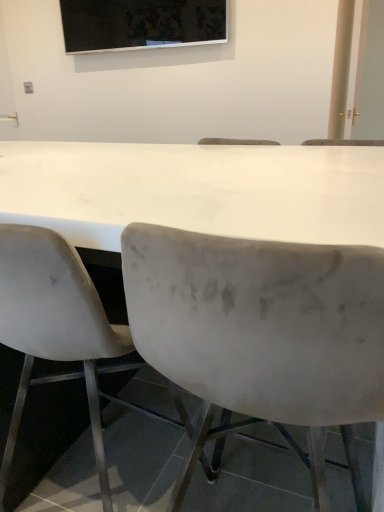
Question: From a real-world perspective, is white matte chair at left, positioned as the first chair in left-to-right order, beneath velvet gray chair at center, which is counted as the 1th chair, starting from the right?

Choices:
 (A) yes
 (B) no

Answer: (A)

Question: Could you tell me if white matte chair at left, positioned as the first chair in left-to-right order, is turned towards velvet gray chair at center, which is counted as the 1th chair, starting from the right?

Choices:
 (A) yes
 (B) no

Answer: (B)

Question: Is velvet gray chair at center, the second chair when ordered from left to right, located within white matte chair at left, positioned as the first chair in left-to-right order?

Choices:
 (A) no
 (B) yes

Answer: (A)

Question: Does white matte chair at left, positioned as the first chair in left-to-right order, come behind velvet gray chair at center, which is counted as the 1th chair, starting from the right?

Choices:
 (A) yes
 (B) no

Answer: (A)

Question: Is white matte chair at left, arranged as the 2th chair when viewed from the right, far from velvet gray chair at center, the second chair when ordered from left to right?

Choices:
 (A) yes
 (B) no

Answer: (B)

Question: Is white matte chair at left, positioned as the first chair in left-to-right order, not within velvet gray chair at center, which is counted as the 1th chair, starting from the right?

Choices:
 (A) yes
 (B) no

Answer: (A)

Question: Does velvet gray chair at center, the second chair when ordered from left to right, turn towards white glossy door at upper right?

Choices:
 (A) no
 (B) yes

Answer: (B)

Question: Does velvet gray chair at center, the second chair when ordered from left to right, come in front of white glossy door at upper right?

Choices:
 (A) yes
 (B) no

Answer: (A)

Question: Are velvet gray chair at center, which is counted as the 1th chair, starting from the right, and white glossy door at upper right located far from each other?

Choices:
 (A) no
 (B) yes

Answer: (B)

Question: Is velvet gray chair at center, the second chair when ordered from left to right, turned away from white glossy door at upper right?

Choices:
 (A) no
 (B) yes

Answer: (A)

Question: Considering the relative sizes of velvet gray chair at center, which is counted as the 1th chair, starting from the right, and white glossy door at upper right in the image provided, is velvet gray chair at center, which is counted as the 1th chair, starting from the right, shorter than white glossy door at upper right?

Choices:
 (A) no
 (B) yes

Answer: (B)

Question: Is velvet gray chair at center, which is counted as the 1th chair, starting from the right, further to the viewer compared to white glossy door at upper right?

Choices:
 (A) yes
 (B) no

Answer: (B)

Question: From the image's perspective, is white matte chair at left, arranged as the 2th chair when viewed from the right, located above black glossy screen at upper center?

Choices:
 (A) no
 (B) yes

Answer: (A)